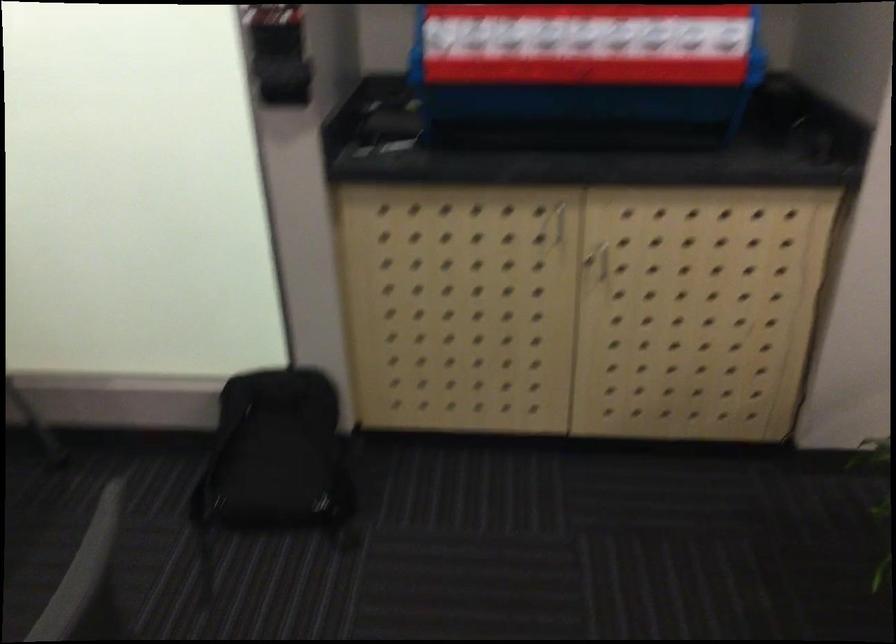
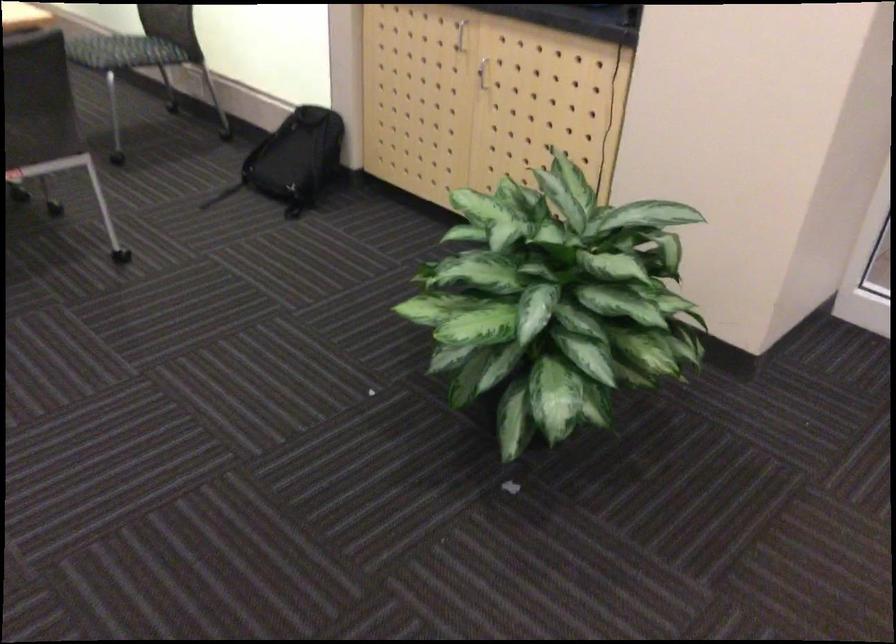
Locate, in the second image, the point that corresponds to (564,220) in the first image.

(460, 35)